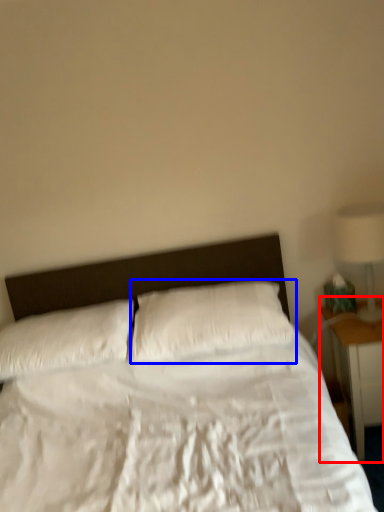
Question: Which point is closer to the camera, nightstand (highlighted by a red box) or pillow (highlighted by a blue box)?

Choices:
 (A) nightstand
 (B) pillow

Answer: (B)